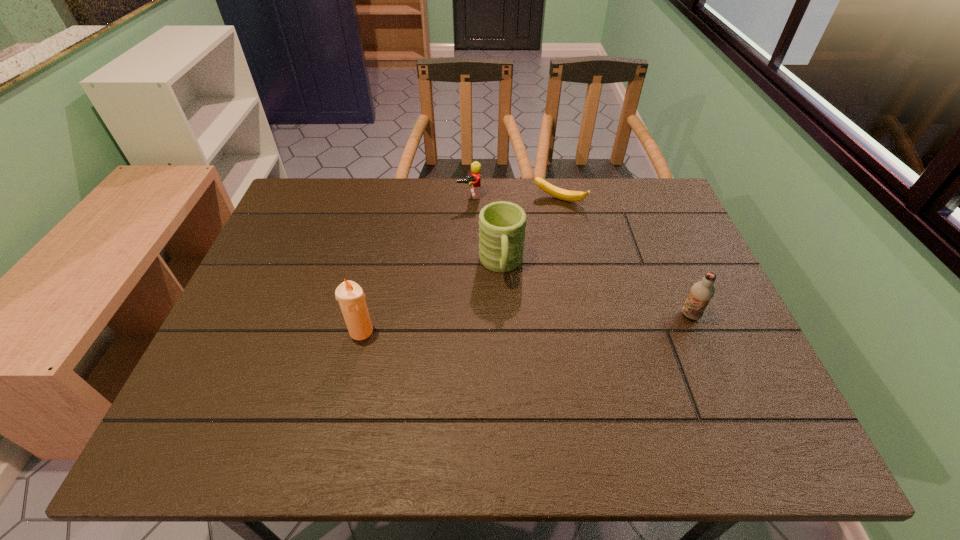
Where is `free space that satisfies the following two spatial constraints: 1. on the back side of the fourth object from left to right; 2. on the left side of the third nearest object`? free space that satisfies the following two spatial constraints: 1. on the back side of the fourth object from left to right; 2. on the left side of the third nearest object is located at coordinates (498, 200).

The image size is (960, 540). I want to click on free location that satisfies the following two spatial constraints: 1. on the back side of the mug; 2. on the left side of the fourth object from left to right, so click(498, 200).

Image resolution: width=960 pixels, height=540 pixels. Find the location of `free point that satisfies the following two spatial constraints: 1. on the back side of the tallest object; 2. on the left side of the rightmost object`. free point that satisfies the following two spatial constraints: 1. on the back side of the tallest object; 2. on the left side of the rightmost object is located at coordinates (365, 315).